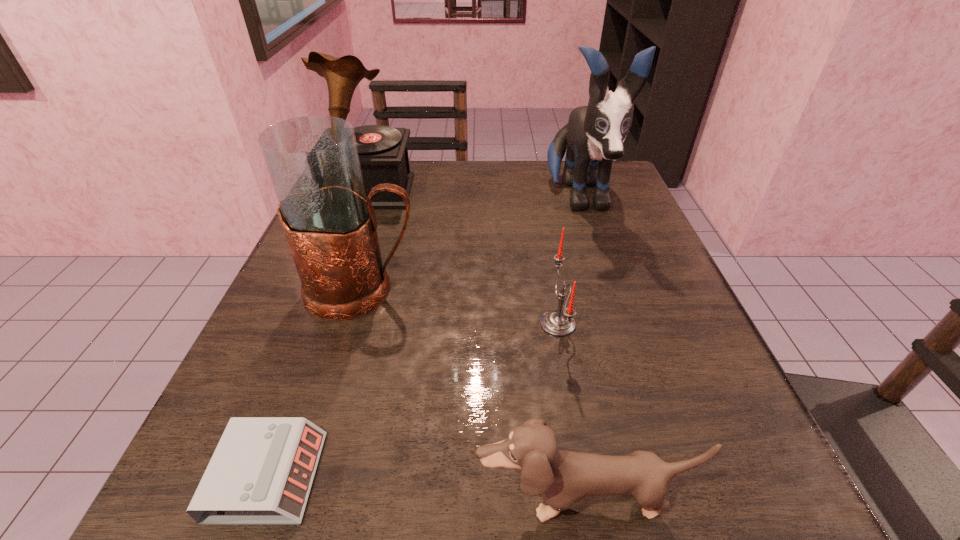
The image size is (960, 540). Identify the location of free space located 0.210m on the front-facing side of the candle. (412, 323).

What are the coordinates of `vacant region located on the front-facing side of the candle` in the screenshot? It's located at (357, 323).

The width and height of the screenshot is (960, 540). I want to click on free space located 0.390m on the back of the alarm clock, so click(x=350, y=252).

I want to click on puppy situated at the far edge, so click(594, 135).

The width and height of the screenshot is (960, 540). Identify the location of phonograph_record located in the far edge section of the desktop. (383, 153).

Find the location of `puppy that is at the near edge`. puppy that is at the near edge is located at coordinates (561, 477).

I want to click on alarm clock present at the near edge, so click(261, 472).

This screenshot has width=960, height=540. I want to click on phonograph_record situated at the left edge, so click(x=383, y=153).

At what (x,y) coordinates should I click in order to perform the action: click on pitcher that is at the left edge. Please return your answer as a coordinate pair (x, y). The height and width of the screenshot is (540, 960). Looking at the image, I should click on (330, 225).

Where is `alarm clock that is positioned at the left edge`? Image resolution: width=960 pixels, height=540 pixels. alarm clock that is positioned at the left edge is located at coordinates (261, 472).